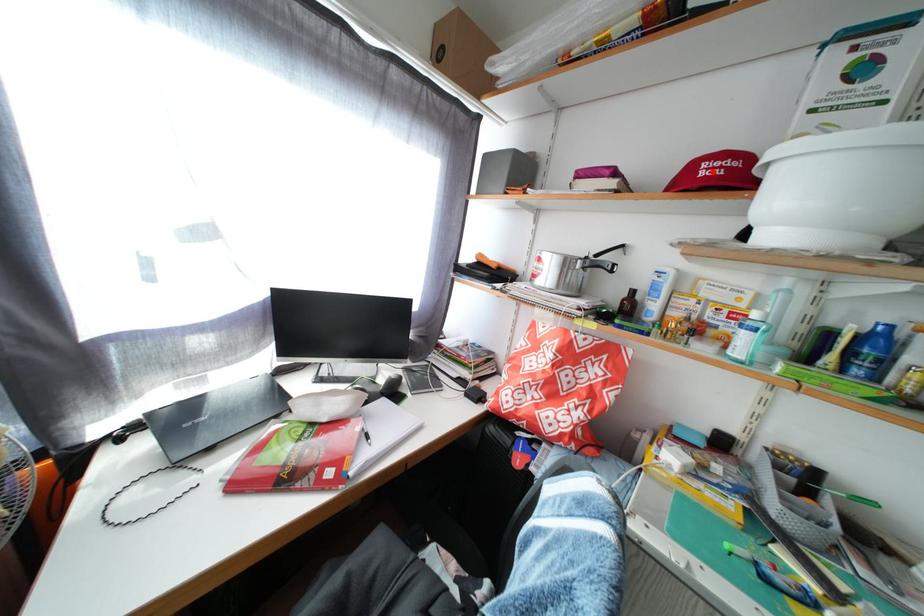
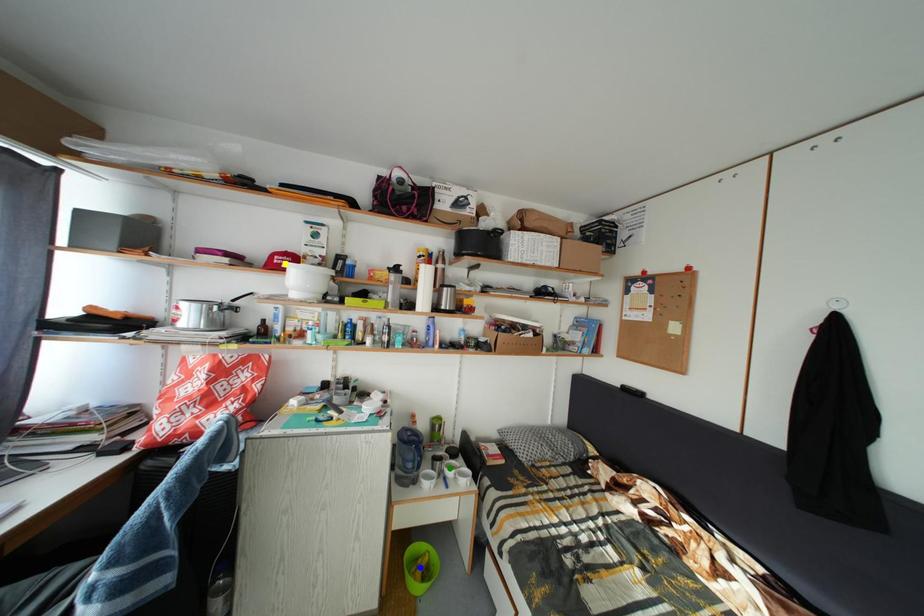
Question: I am providing you with two images of the same scene from different viewpoints. A red point is marked on the first image. You are given multiple points on the second image. In image 2, which mark is for the same physical point as the one in image 1?

Choices:
 (A) green point
 (B) yellow point
 (C) blue point

Answer: (B)